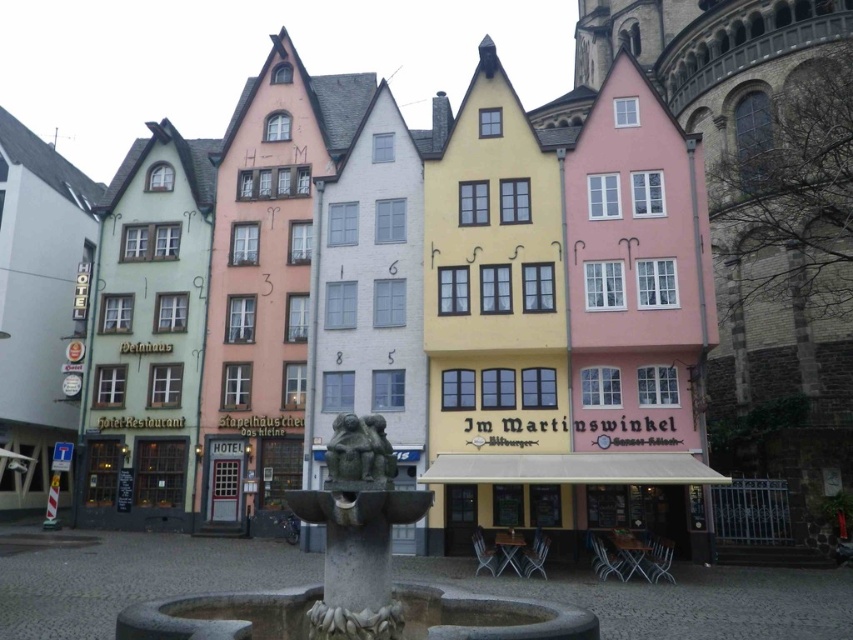
Question: Is the position of granite fountain at center more distant than that of green stone statue at center?

Choices:
 (A) no
 (B) yes

Answer: (A)

Question: From the image, what is the correct spatial relationship of granite fountain at center in relation to green stone statue at center?

Choices:
 (A) above
 (B) below

Answer: (B)

Question: Can you confirm if granite fountain at center is thinner than green stone statue at center?

Choices:
 (A) yes
 (B) no

Answer: (B)

Question: Which point is closer to the camera?

Choices:
 (A) granite fountain at center
 (B) green stone statue at center

Answer: (A)